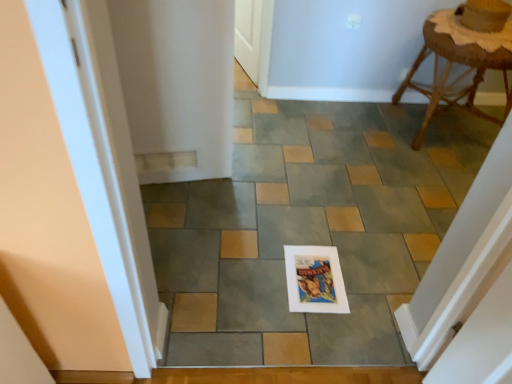
Where is `vacant area that is in front of rattan stool at upper right`? vacant area that is in front of rattan stool at upper right is located at coordinates (432, 173).